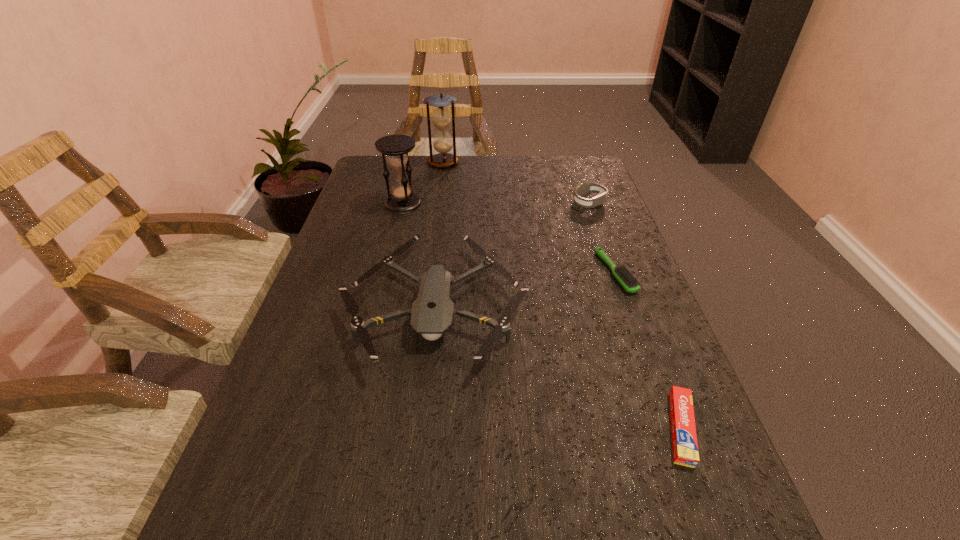
Identify the location of vacant area situated on the face of the watch. This screenshot has width=960, height=540. (514, 204).

Where is `free space located on the face of the watch`? Image resolution: width=960 pixels, height=540 pixels. free space located on the face of the watch is located at coordinates (531, 204).

Image resolution: width=960 pixels, height=540 pixels. I want to click on vacant space located 0.140m on the face of the watch, so click(524, 204).

At what (x,y) coordinates should I click in order to perform the action: click on vacant region located 0.160m with a camera mounted on the front of the drone. Please return your answer as a coordinate pair (x, y). Looking at the image, I should click on (419, 467).

This screenshot has height=540, width=960. What are the coordinates of `free region located on the back of the fifth tallest object` in the screenshot? It's located at pyautogui.click(x=589, y=200).

You are a GUI agent. You are given a task and a screenshot of the screen. Output one action in this format:
    pyautogui.click(x=<x>, y=<y>)
    Task: Click on the vacant space located on the left of the toothpaste
    
    Given the screenshot: What is the action you would take?
    pyautogui.click(x=549, y=428)

This screenshot has height=540, width=960. What are the coordinates of `object situated at the far edge` in the screenshot? It's located at pyautogui.click(x=441, y=117).

At what (x,y) coordinates should I click in order to perform the action: click on hourglass situated at the left edge. Please return your answer as a coordinate pair (x, y). Image resolution: width=960 pixels, height=540 pixels. Looking at the image, I should click on (402, 200).

The height and width of the screenshot is (540, 960). I want to click on drone that is at the left edge, so click(431, 314).

You are a GUI agent. You are given a task and a screenshot of the screen. Output one action in this format:
    pyautogui.click(x=<x>, y=<y>)
    Task: Click on the watch that is at the right edge
    
    Given the screenshot: What is the action you would take?
    pyautogui.click(x=583, y=188)